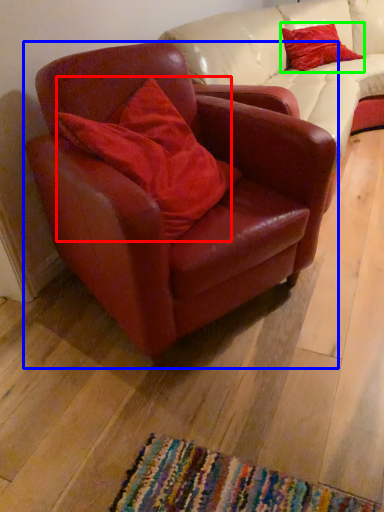
Question: Considering the real-world distances, which object is farthest from pillow (highlighted by a red box)? chair (highlighted by a blue box) or pillow (highlighted by a green box)?

Choices:
 (A) chair
 (B) pillow

Answer: (B)